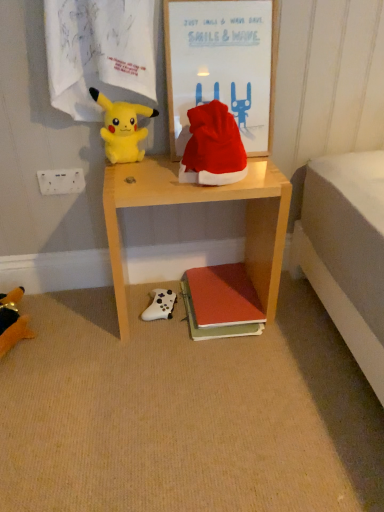
Question: Is wooden desk at center wider or thinner than wooden framed poster at upper center?

Choices:
 (A) wide
 (B) thin

Answer: (A)

Question: In terms of size, does wooden desk at center appear bigger or smaller than wooden framed poster at upper center?

Choices:
 (A) small
 (B) big

Answer: (B)

Question: Which of these objects is positioned farthest from the white plastic power outlet at upper left?

Choices:
 (A) wooden desk at center
 (B) white matte game controller at lower center, the first toy positioned from the right
 (C) soft plush toy at lower left, positioned as the first toy in left-to-right order
 (D) red velvet santa hat at center
 (E) yellow plush toy at upper left, placed as the 2th toy when sorted from right to left

Answer: (B)

Question: Which object is the farthest from the wooden framed poster at upper center?

Choices:
 (A) matte orange book at lower center
 (B) white matte game controller at lower center, the first toy positioned from the right
 (C) soft plush toy at lower left, placed as the 3th toy when sorted from right to left
 (D) white plastic power outlet at upper left
 (E) wooden desk at center

Answer: (C)